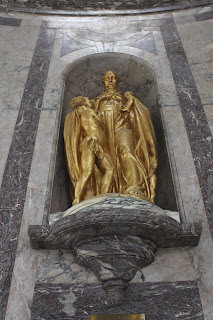
Locate an element on the screen. robe is located at coordinates (141, 120), (69, 127).